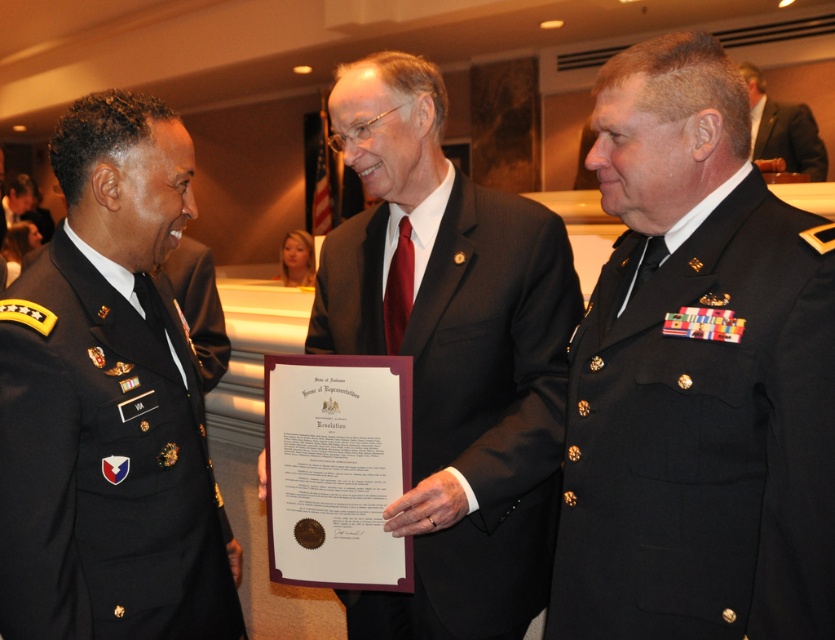
You are an event planner organizing a photo shoot for a military award ceremony. You need to position two central figures wearing the black matte uniform at center and the black matte suit at center. Which one should be placed closer to the camera to ensure both are visible in the frame?

The black matte uniform at center is smaller than the black matte suit at center, so placing the black matte uniform at center closer to the camera will ensure both are visible in the frame.

You are a photographer at a military ceremony. You need to capture a photo where both the black matte uniform at center and the black matte suit at center are clearly visible. Given their height difference, which one might you position closer to the camera to ensure both are fully visible in the frame?

The black matte uniform at center is shorter than the black matte suit at center. To ensure both are fully visible, position the shorter black matte uniform at center closer to the camera so that the taller black matte suit at center doesn

You are a photographer positioned behind the black matte suit at center and dark suit at center. Which suit will appear larger in your photo?

The black matte suit at center will appear larger in the photo because it is closer to the viewer than the dark suit at center.